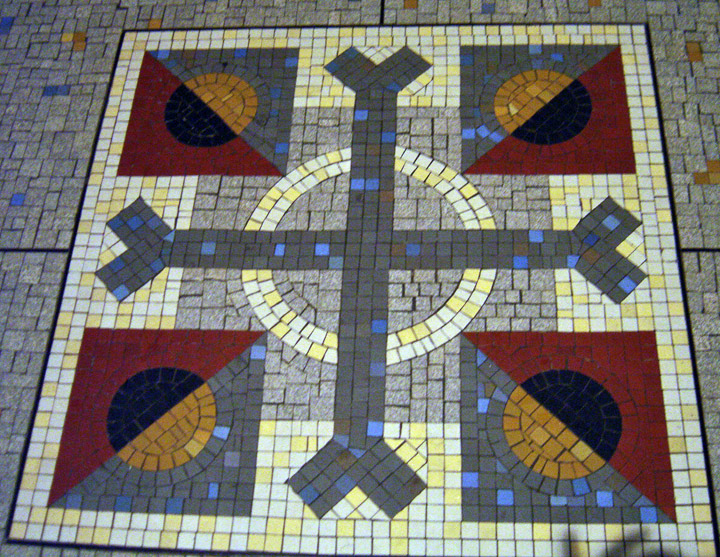
Where is `rectangular blue tile`? The image size is (720, 557). rectangular blue tile is located at coordinates (216, 488).